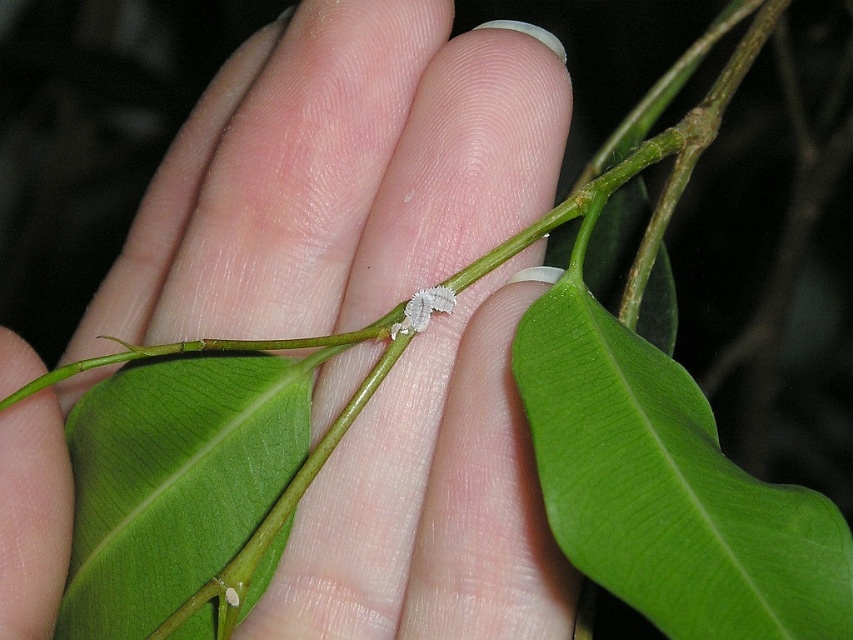
Question: Does green matte leaf at center appear under clear plastic ring on the upper right?

Choices:
 (A) yes
 (B) no

Answer: (A)

Question: Among these objects, which one is nearest to the camera?

Choices:
 (A) green smooth leaf at center
 (B) white fuzzy caterpillar at center

Answer: (A)

Question: Which of the following is the closest to the observer?

Choices:
 (A) white matte leaf at center
 (B) clear plastic ring on the upper right

Answer: (A)

Question: Which object is the farthest from the green smooth leaf at center?

Choices:
 (A) clear plastic ring on the upper right
 (B) white matte leaf at center
 (C) white fuzzy caterpillar at center

Answer: (A)

Question: Does white matte leaf at center appear over clear plastic ring on the upper right?

Choices:
 (A) no
 (B) yes

Answer: (A)

Question: Does green matte leaf at center have a lesser width compared to clear plastic ring on the upper right?

Choices:
 (A) no
 (B) yes

Answer: (A)